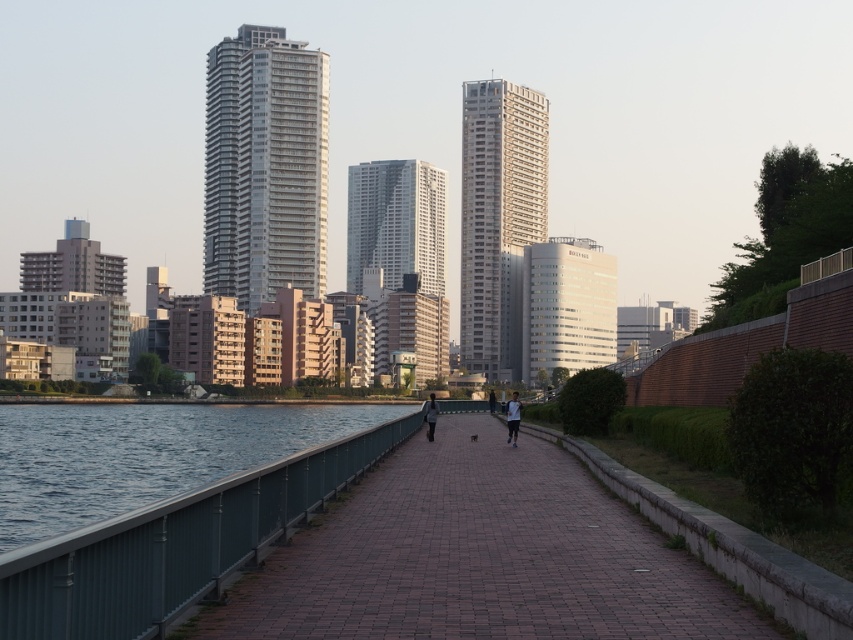
Question: Which of these objects is positioned closest to the white smooth building at center?

Choices:
 (A) glossy glass building at center
 (B) light brown leather jacket at center
 (C) glassy metallic skyscraper at center

Answer: (A)

Question: Which object is the farthest from the glossy glass building at center?

Choices:
 (A) dark gray fabric jacket at center
 (B) glassy metallic skyscraper at center
 (C) paved brick sidewalk at center
 (D) light brown leather jacket at center

Answer: (C)

Question: Can you confirm if glassy metallic skyscraper at center is thinner than dark gray fabric jacket at center?

Choices:
 (A) no
 (B) yes

Answer: (A)

Question: Which point is farther to the camera?

Choices:
 (A) green metallic railing at lower left
 (B) dark gray fabric jacket at center

Answer: (B)

Question: Is glassy metallic skyscraper at center above white glass skyscraper at center?

Choices:
 (A) no
 (B) yes

Answer: (A)

Question: Does green metallic railing at lower left have a larger size compared to dark gray fabric jacket at center?

Choices:
 (A) yes
 (B) no

Answer: (A)